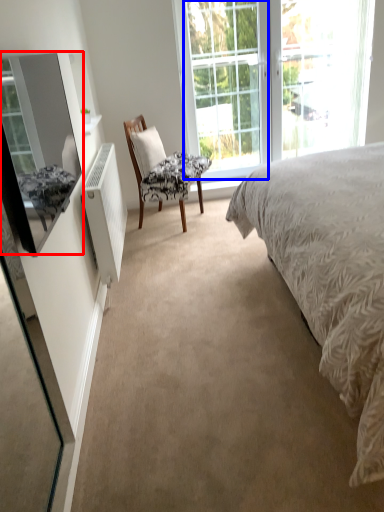
Question: Among these objects, which one is farthest to the camera, mirror (highlighted by a red box) or glass door (highlighted by a blue box)?

Choices:
 (A) mirror
 (B) glass door

Answer: (B)